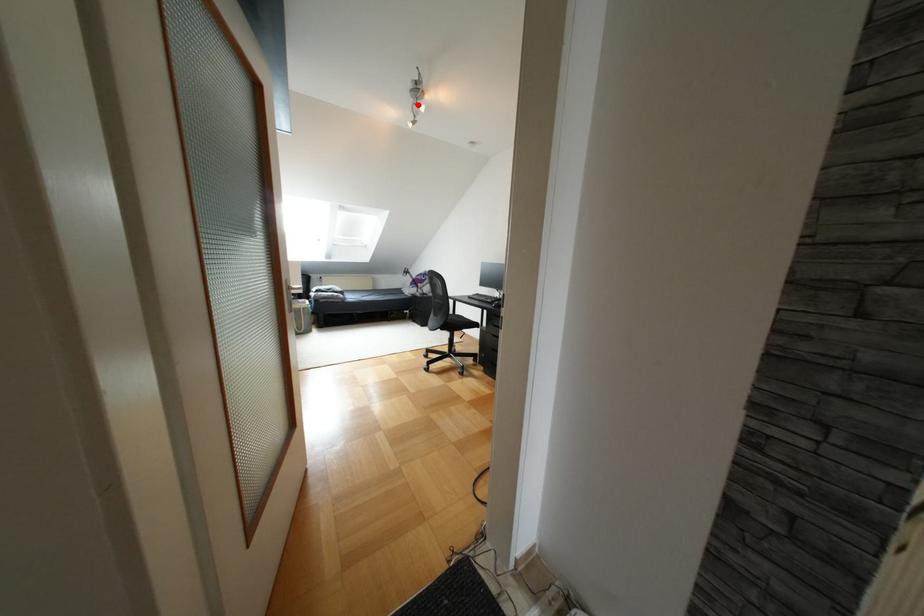
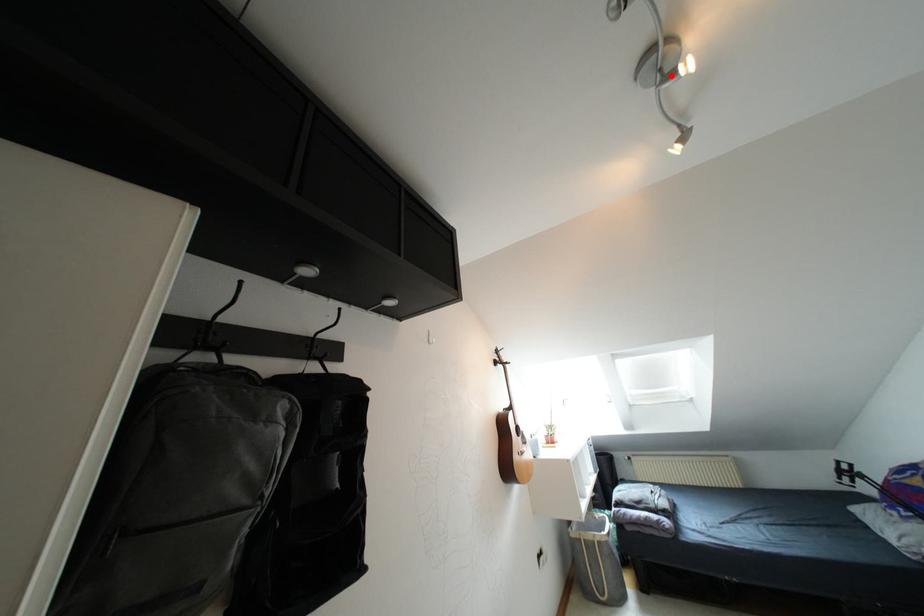
I am providing you with two images of the same scene from different viewpoints. A red point is marked on the first image and another point is marked on the second image. Is the red point in image1 aligned with the point shown in image2?

Yes